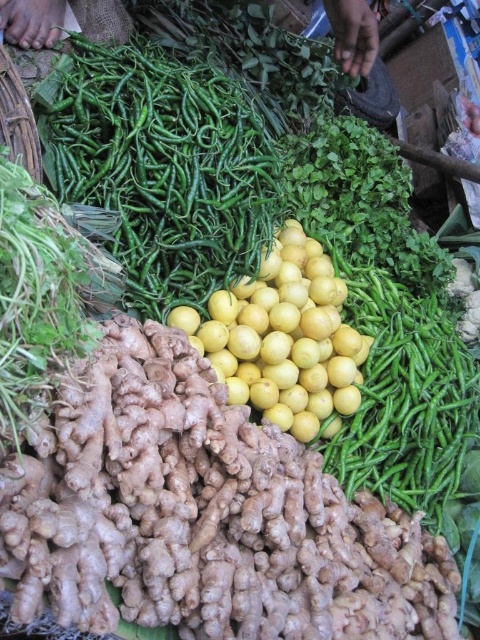
You are standing at the market stall and want to reach a point exactly 1.5 meters away from where you are currently standing. Is the point at coordinates point (180, 282) within that 1.5 meter range?

The distance between point (180, 282) and the viewer is 1.68 meters, which is beyond the 1.5 meter range. Therefore, the point at coordinates point (180, 282) is outside the desired range.

You are a customer at the market stall and want to pick up the green glossy chili peppers at upper center and the yellow matte lemon at center. Which one is located to the left?

The green glossy chili peppers at upper center is located to the left of the yellow matte lemon at center.

You are a customer at the market stall and want to buy the green glossy chili peppers at upper center. The vendor tells you that the peppers are located at coordinate point 0.261, 0.338. If you move towards the peppers, which direction should you walk relative to your current position at the center of the stall?

Since the green glossy chili peppers at upper center are located at coordinate point (162, 166), which is to the upper left from the center of the stall, you should walk towards the upper left direction to reach them.